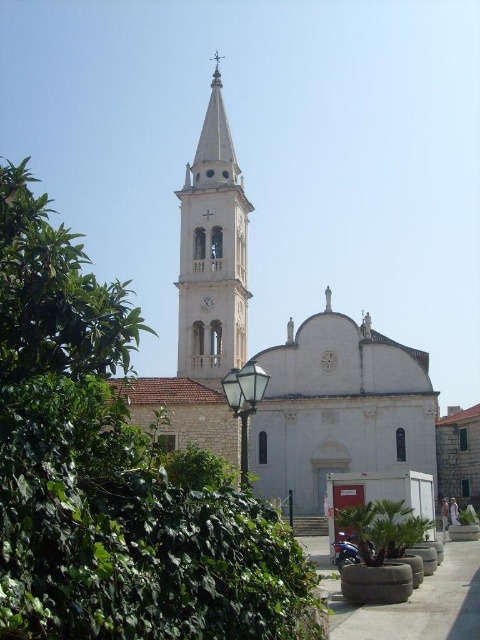
Does white stone church at center have a greater width compared to white stone bell tower at center?

Correct, the width of white stone church at center exceeds that of white stone bell tower at center.

This screenshot has height=640, width=480. Describe the element at coordinates (339, 408) in the screenshot. I see `white stone church at center` at that location.

Locate an element on the screen. The width and height of the screenshot is (480, 640). white stone church at center is located at coordinates (339, 408).

Which is above, green leafy tree at left or white stone bell tower at center?

Positioned higher is white stone bell tower at center.

Is green leafy tree at left shorter than white stone bell tower at center?

Indeed, green leafy tree at left has a lesser height compared to white stone bell tower at center.

Describe the element at coordinates (113, 474) in the screenshot. This screenshot has height=640, width=480. I see `green leafy tree at left` at that location.

Where is `green leafy tree at left`? green leafy tree at left is located at coordinates (113, 474).

In the scene shown: Is green leafy tree at left closer to camera compared to white stone church at center?

Yes, it is in front of white stone church at center.

Is point (219, 618) farther from viewer compared to point (355, 435)?

That is False.

I want to click on green leafy tree at left, so click(x=113, y=474).